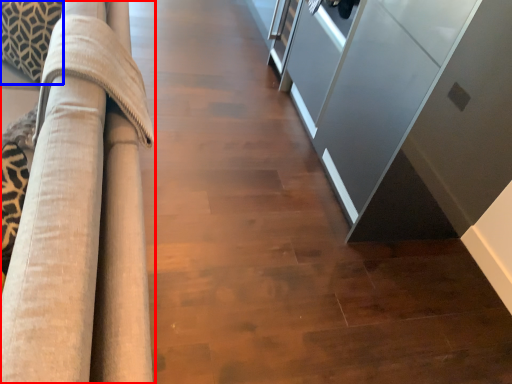
Question: Which object is closer to the camera taking this photo, furniture (highlighted by a red box) or pillow (highlighted by a blue box)?

Choices:
 (A) furniture
 (B) pillow

Answer: (A)